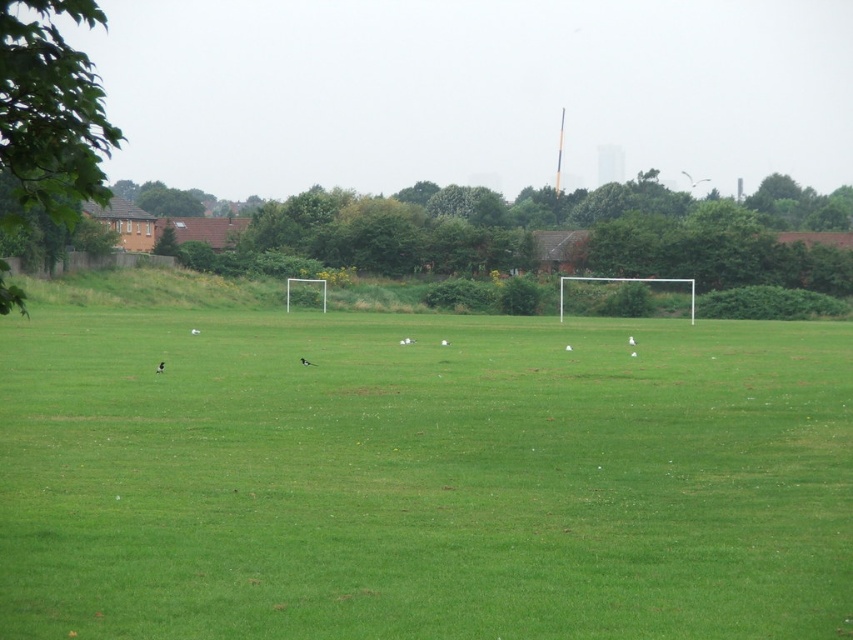
You are a landscape architect designing a new park. You need to place a large statue in the green grass field at center so that it doesn not block the view of the green leafy tree at left. Given their sizes, is this possible?

The green grass field at center has a smaller size compared to green leafy tree at left. Since the field is smaller, placing a large statue there might not block the view of the tree as the tree is larger and possibly taller, ensuring visibility.